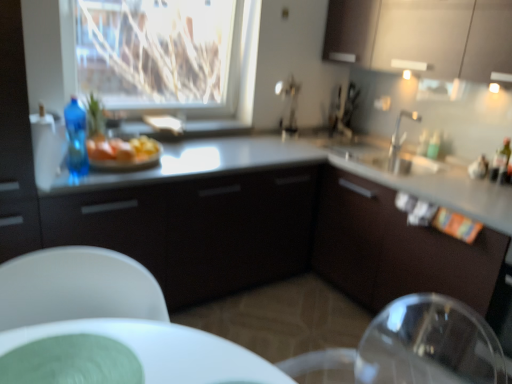
Describe the element at coordinates (76, 139) in the screenshot. I see `blue plastic bottle at left` at that location.

What do you see at coordinates (197, 229) in the screenshot?
I see `matte black cabinet at center, the first cabinetry positioned from the left` at bounding box center [197, 229].

The image size is (512, 384). I want to click on matte white cabinets at upper right, the first cabinetry from the top, so click(422, 35).

This screenshot has height=384, width=512. I want to click on white plastic chair at lower left, so click(77, 287).

This screenshot has width=512, height=384. What do you see at coordinates (168, 54) in the screenshot?
I see `transparent glass window at upper center` at bounding box center [168, 54].

At what (x,y) coordinates should I click in order to perform the action: click on blue plastic bottle at left. Please return your answer as a coordinate pair (x, y). Looking at the image, I should click on (76, 139).

Is silver metallic faucet at upper right positioned with its back to yellow butter at center?

No, silver metallic faucet at upper right is not facing away from yellow butter at center.

Is silver metallic faucet at upper right wider or thinner than yellow butter at center?

In the image, silver metallic faucet at upper right appears to be wider than yellow butter at center.

Measure the distance from silver metallic faucet at upper right to yellow butter at center.

silver metallic faucet at upper right is 1.56 meters from yellow butter at center.

From a real-world perspective, relative to yellow butter at center, is silver metallic faucet at upper right vertically above or below?

In terms of real-world spatial position, silver metallic faucet at upper right is above yellow butter at center.

Is white plastic chair at lower left with matte black cabinet at center, the second cabinetry viewed from the top?

white plastic chair at lower left and matte black cabinet at center, the second cabinetry viewed from the top, are not in contact.

From the image's perspective, is white plastic chair at lower left under matte black cabinet at center, the second cabinetry viewed from the top?

Yes, from the image's perspective, white plastic chair at lower left is below matte black cabinet at center, the second cabinetry viewed from the top.

From a real-world perspective, which is physically above, white plastic chair at lower left or matte black cabinet at center, which is the second cabinetry in right-to-left order?

white plastic chair at lower left, from a real-world perspective.

Could you measure the distance between white plastic chair at lower left and matte black cabinet at center, the 1th cabinetry positioned from the bottom?

white plastic chair at lower left is 71.44 centimeters from matte black cabinet at center, the 1th cabinetry positioned from the bottom.

Would you consider yellow butter at center to be distant from silver metallic faucet at upper right?

yellow butter at center is far away from silver metallic faucet at upper right.

The height and width of the screenshot is (384, 512). I want to click on food that appears on the left of silver metallic faucet at upper right, so click(x=144, y=147).

Does yellow butter at center have a greater width compared to silver metallic faucet at upper right?

Incorrect, the width of yellow butter at center does not surpass that of silver metallic faucet at upper right.

From a real-world perspective, which is physically below, yellow butter at center or silver metallic faucet at upper right?

In real-world perspective, yellow butter at center is lower.

Who is shorter, blue plastic bottle at left or white plastic chair at lower left?

blue plastic bottle at left is shorter.

Looking at the image, does blue plastic bottle at left seem bigger or smaller compared to white plastic chair at lower left?

Considering their sizes, blue plastic bottle at left takes up less space than white plastic chair at lower left.

Would you say blue plastic bottle at left is a long distance from white plastic chair at lower left?

Actually, blue plastic bottle at left and white plastic chair at lower left are a little close together.

Does blue plastic bottle at left appear on the right side of white plastic chair at lower left?

Incorrect, blue plastic bottle at left is not on the right side of white plastic chair at lower left.

Find the location of `bottle behind the green matte plate at lower left`. bottle behind the green matte plate at lower left is located at coordinates (76, 139).

Considering the sizes of objects green matte plate at lower left and blue plastic bottle at left in the image provided, who is shorter, green matte plate at lower left or blue plastic bottle at left?

Standing shorter between the two is green matte plate at lower left.

Considering the positions of objects green matte plate at lower left and blue plastic bottle at left in the image provided, who is behind, green matte plate at lower left or blue plastic bottle at left?

blue plastic bottle at left is further from the camera.

Can you confirm if yellow butter at center is taller than transparent glass window at upper center?

No.

Is yellow butter at center to the right of transparent glass window at upper center from the viewer's perspective?

Yes, yellow butter at center is to the right of transparent glass window at upper center.

Considering the points (143, 136) and (90, 80), which point is in front, point (143, 136) or point (90, 80)?

Positioned in front is point (143, 136).

From the image's perspective, is silver metallic faucet at upper right below transparent glass window at upper center?

Yes, from the image's perspective, silver metallic faucet at upper right is beneath transparent glass window at upper center.

Based on the photo, considering the positions of objects silver metallic faucet at upper right and transparent glass window at upper center in the image provided, who is more to the right, silver metallic faucet at upper right or transparent glass window at upper center?

Positioned to the right is silver metallic faucet at upper right.

Looking at this image, could you tell me if silver metallic faucet at upper right is turned towards transparent glass window at upper center?

No, silver metallic faucet at upper right does not turn towards transparent glass window at upper center.

The image size is (512, 384). Identify the location of food below the silver metallic faucet at upper right (from the image's perspective). (144, 147).

Locate an element on the screen. chair to the left of matte black cabinet at center, the first cabinetry positioned from the left is located at coordinates (77, 287).

Based on their spatial positions, is matte white cabinets at upper right, the second cabinetry ordered from the bottom, or matte black cabinet at center, the second cabinetry viewed from the top, further from white plastic chair at lower left?

matte white cabinets at upper right, the second cabinetry ordered from the bottom, lies further to white plastic chair at lower left than the other object.

From the image, which object appears to be nearer to blue plastic bottle at left, green matte plate at lower left or white plastic chair at lower left?

The object closer to blue plastic bottle at left is white plastic chair at lower left.

Based on their spatial positions, is matte white cabinets at upper right, the first cabinetry from the top, or yellow butter at center closer to blue plastic bottle at left?

yellow butter at center is closer to blue plastic bottle at left.

Based on their spatial positions, is silver metallic faucet at upper right or green matte plate at lower left closer to transparent glass window at upper center?

Based on the image, silver metallic faucet at upper right appears to be nearer to transparent glass window at upper center.

Considering their positions, is yellow butter at center positioned further to transparent glass window at upper center than white plastic chair at lower left?

white plastic chair at lower left.

Which object lies further to the anchor point matte white cabinets at upper right, the second cabinetry ordered from the bottom, yellow butter at center or blue plastic bottle at left?

Based on the image, blue plastic bottle at left appears to be further to matte white cabinets at upper right, the second cabinetry ordered from the bottom.

Looking at the image, which one is located further to matte black cabinet at center, which is the second cabinetry in right-to-left order, white plastic chair at lower left or blue plastic bottle at left?

white plastic chair at lower left lies further to matte black cabinet at center, which is the second cabinetry in right-to-left order, than the other object.

Estimate the real-world distances between objects in this image. Which object is further from yellow butter at center, blue plastic bottle at left or transparent glass window at upper center?

transparent glass window at upper center lies further to yellow butter at center than the other object.

At what (x,y) coordinates should I click in order to perform the action: click on cabinetry between blue plastic bottle at left and matte white cabinets at upper right, the first cabinetry from the top, from left to right. Please return your answer as a coordinate pair (x, y). This screenshot has width=512, height=384. Looking at the image, I should click on (197, 229).

Find the location of a particular element. The height and width of the screenshot is (384, 512). chair between blue plastic bottle at left and matte white cabinets at upper right, which ranks as the 1th cabinetry in right-to-left order, from left to right is located at coordinates point(77,287).

Locate an element on the screen. This screenshot has height=384, width=512. food between white plastic chair at lower left and silver metallic faucet at upper right along the z-axis is located at coordinates (144, 147).

The height and width of the screenshot is (384, 512). I want to click on glass plate between transparent glass window at upper center and white plastic chair at lower left in the up-down direction, so click(x=71, y=362).